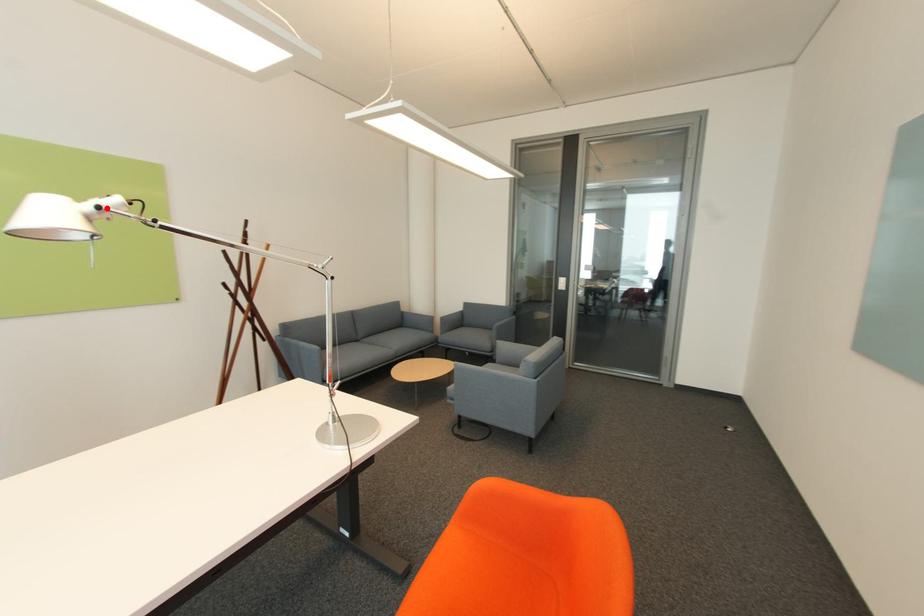
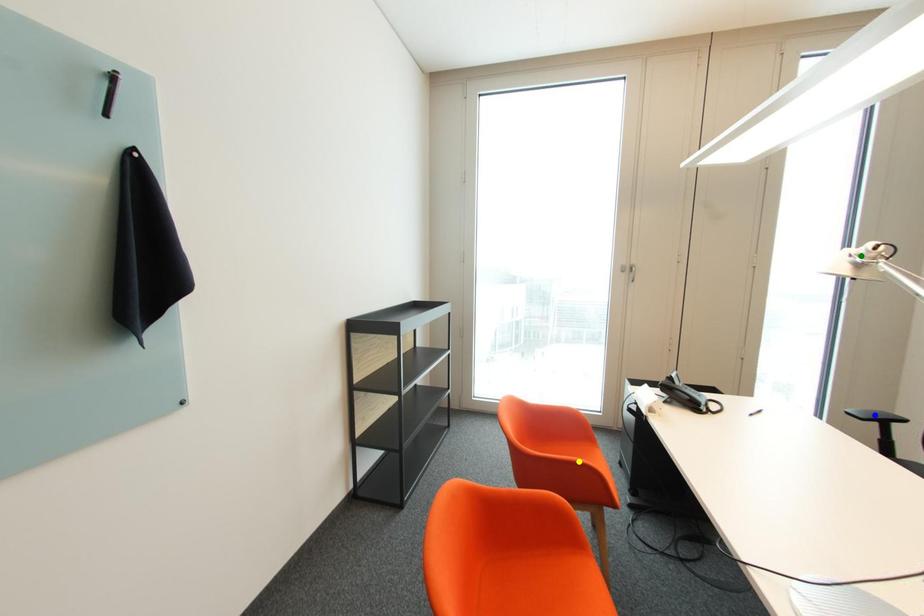
Question: I am providing you with two images of the same scene from different viewpoints. A red point is marked on the first image. You are given multiple points on the second image. Which mark in image 2 goes with the point in image 1?

Choices:
 (A) green point
 (B) yellow point
 (C) blue point

Answer: (A)